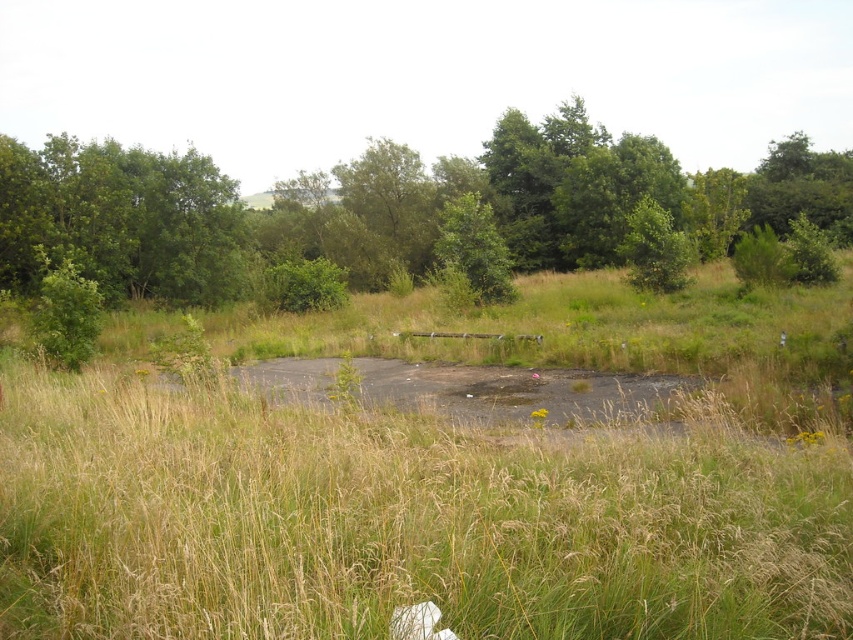
You are standing in the middle of the cleared area and want to walk towards the green leafy tree at center. However, there is another green leafy tree at upper left blocking your path. Can you walk directly to the tree at center without going around the other tree?

The green leafy tree at upper left is positioned over the green leafy tree at center, so you cannot walk directly to the tree at center without going around the other tree because it is blocking the path.

You are planning to install a small garden between the green leafy tree at upper left and the green leafy tree at center. The garden requires a space of 25 feet between the two trees. Is there enough space between them to accommodate the garden?

The green leafy tree at upper left and the green leafy tree at center are 29.61 feet apart from each other. Since the required space is 25 feet, there is enough space between them to accommodate the garden.

You are standing in the middle of the cleared area and want to take a photo of both the green leafy tree at upper left and the green leafy tree at center. Which tree should you position yourself closer to in order to capture both in a single frame?

You should position yourself closer to the green leafy tree at center because the green leafy tree at upper left is much taller, so moving closer to the shorter tree will help include both in the frame.